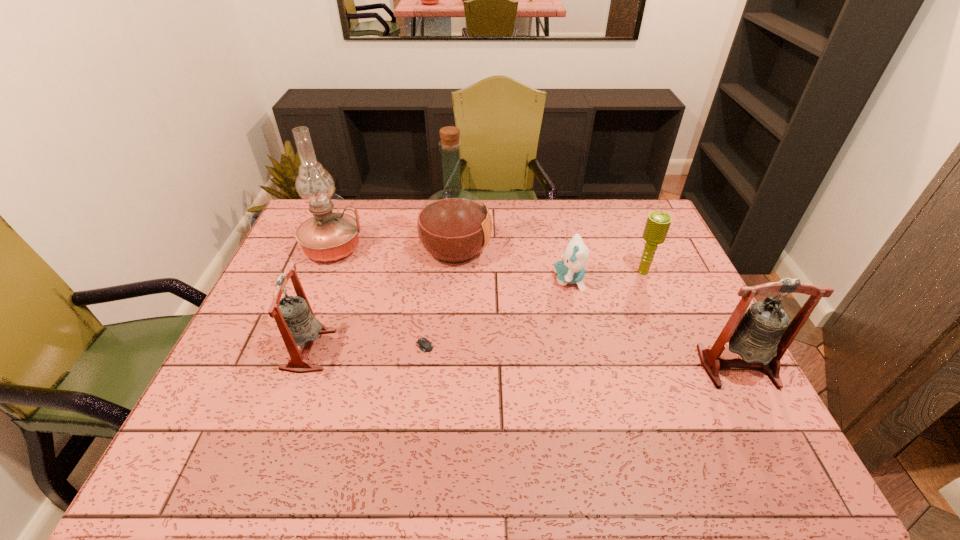
Find the location of a particular element. This screenshot has height=540, width=960. free area in between the kitten and the rightmost object is located at coordinates (654, 323).

The height and width of the screenshot is (540, 960). Identify the location of empty space that is in between the oil lamp and the left bell. (321, 299).

Image resolution: width=960 pixels, height=540 pixels. Identify the location of the closest object relative to the mouse. (297, 324).

Locate which object ranks second in proximity to the right bell. Please provide its 2D coordinates. Your answer should be formatted as a tuple, i.e. [(x, y)], where the tuple contains the x and y coordinates of a point satisfying the conditions above.

[(571, 270)]

Locate an element on the screen. This screenshot has height=540, width=960. free point that satisfies the following two spatial constraints: 1. on the front side of the fifth tallest object; 2. on the right side of the oil lamp is located at coordinates (324, 273).

Where is `free location that satisfies the following two spatial constraints: 1. on the face of the rightmost object; 2. on the right side of the sixth tallest object`? The width and height of the screenshot is (960, 540). free location that satisfies the following two spatial constraints: 1. on the face of the rightmost object; 2. on the right side of the sixth tallest object is located at coordinates (588, 367).